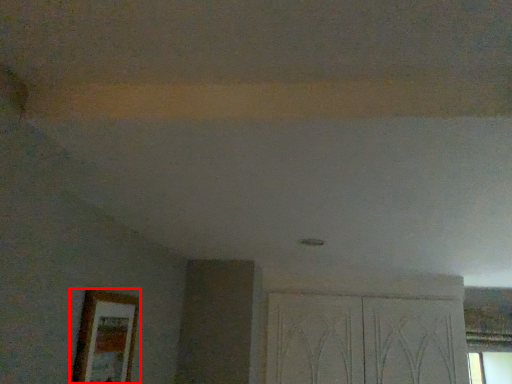
Question: Observing the image, what is the correct spatial positioning of picture frame (annotated by the red box) in reference to screen door?

Choices:
 (A) left
 (B) right

Answer: (A)